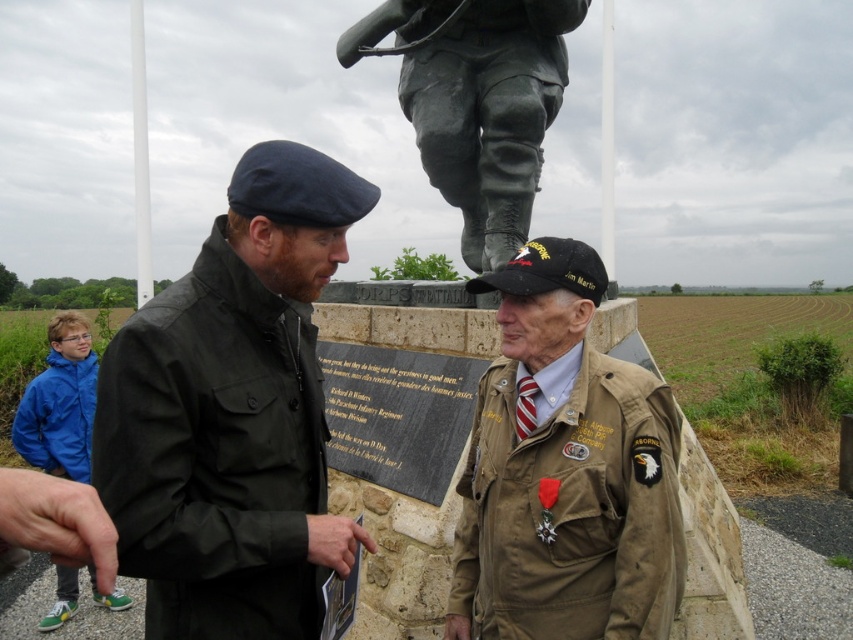
Question: Estimate the real-world distances between objects in this image. Which object is closer to the blue nylon jacket at lower left?

Choices:
 (A) dark green fabric jacket at center
 (B) bronze statue at upper center
 (C) tan fabric jacket at lower right

Answer: (A)

Question: Which object is the closest to the bronze statue at upper center?

Choices:
 (A) dark green fabric jacket at center
 (B) blue nylon jacket at lower left
 (C) tan fabric jacket at lower right

Answer: (C)

Question: Is tan fabric jacket at lower right above bronze statue at upper center?

Choices:
 (A) no
 (B) yes

Answer: (A)

Question: Is dark green fabric jacket at center smaller than bronze statue at upper center?

Choices:
 (A) yes
 (B) no

Answer: (A)

Question: Among these points, which one is farthest from the camera?

Choices:
 (A) (525, 156)
 (B) (28, 420)

Answer: (B)

Question: Can you confirm if dark green fabric jacket at center is thinner than tan fabric jacket at lower right?

Choices:
 (A) yes
 (B) no

Answer: (B)